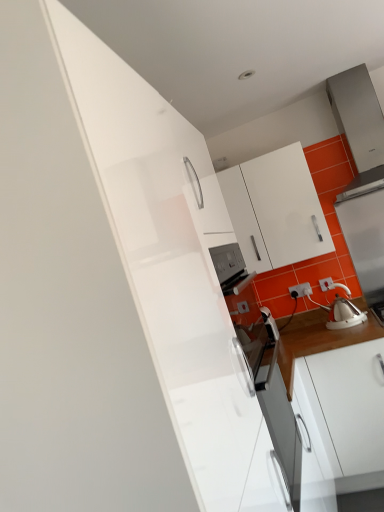
Measure the distance between white plastic electric outlet at lower right and camera.

white plastic electric outlet at lower right is 2.98 meters away from camera.

What do you see at coordinates (342, 310) in the screenshot?
I see `white glossy tea pot at right` at bounding box center [342, 310].

I want to click on white plastic electric outlet at lower right, so click(300, 290).

Consider the image. From a real-world perspective, is white plastic electric outlet at lower right physically located above or below white glossy tea pot at right?

From a real-world perspective, white plastic electric outlet at lower right is physically above white glossy tea pot at right.

Is white plastic electric outlet at lower right facing towards white glossy tea pot at right?

No, white plastic electric outlet at lower right is not oriented towards white glossy tea pot at right.

Is white plastic electric outlet at lower right bigger or smaller than white glossy tea pot at right?

Considering their sizes, white plastic electric outlet at lower right takes up less space than white glossy tea pot at right.

Between white plastic electric outlet at lower right and white glossy tea pot at right, which one has more height?

With more height is white glossy tea pot at right.

Is white plastic electric outlet at lower right to the left of white glossy cabinet at upper center from the viewer's perspective?

No.

Consider the image. How different are the orientations of white plastic electric outlet at lower right and white glossy cabinet at upper center in degrees?

white plastic electric outlet at lower right and white glossy cabinet at upper center are facing 0.00426 degrees away from each other.

Which of these two, white plastic electric outlet at lower right or white glossy cabinet at upper center, is smaller?

Smaller between the two is white plastic electric outlet at lower right.

In the scene shown: From the image's perspective, is white plastic electric outlet at lower right located beneath white glossy cabinet at upper center?

Yes, from the image's perspective, white plastic electric outlet at lower right is below white glossy cabinet at upper center.

From the image's perspective, which is above, white glossy cabinet at upper center or white plastic electric outlet at lower right?

From the image's view, white glossy cabinet at upper center is above.

Would you say white glossy cabinet at upper center is outside white plastic electric outlet at lower right?

Yes, white glossy cabinet at upper center is outside of white plastic electric outlet at lower right.

Which is less distant, (247, 222) or (305, 291)?

The point (247, 222) is closer.

Is white glossy cabinet at upper center thinner than white plastic electric outlet at lower right?

No, white glossy cabinet at upper center is not thinner than white plastic electric outlet at lower right.

Is white glossy tea pot at right completely or partially outside of white plastic electric outlet at lower right?

Yes, white glossy tea pot at right is located beyond the bounds of white plastic electric outlet at lower right.

Could you tell me if white glossy tea pot at right is facing white plastic electric outlet at lower right?

No, white glossy tea pot at right is not turned towards white plastic electric outlet at lower right.

Looking at this image, considering the relative sizes of white glossy tea pot at right and white plastic electric outlet at lower right in the image provided, is white glossy tea pot at right smaller than white plastic electric outlet at lower right?

No.

Is white glossy tea pot at right in contact with white plastic electric outlet at lower right?

No, white glossy tea pot at right is not in contact with white plastic electric outlet at lower right.

Looking at this image, considering the sizes of objects white glossy cabinet at upper center and white glossy kettle at right in the image provided, who is smaller, white glossy cabinet at upper center or white glossy kettle at right?

Smaller between the two is white glossy kettle at right.

Which of these two, white glossy cabinet at upper center or white glossy kettle at right, stands shorter?

Standing shorter between the two is white glossy cabinet at upper center.

Between point (243, 213) and point (362, 222), which one is positioned behind?

The point (362, 222) is farther from the camera.

Would you say white glossy cabinet at upper center is a long distance from white glossy kettle at right?

No, white glossy cabinet at upper center is not far away from white glossy kettle at right.

Which is farther, (376, 258) or (291, 149)?

The point (376, 258) is more distant.

How much distance is there between white glossy kettle at right and white glossy cabinet at upper center?

white glossy kettle at right and white glossy cabinet at upper center are 18.77 inches apart.

From the image's perspective, who appears lower, white glossy kettle at right or white glossy cabinet at upper center?

From the image's view, white glossy kettle at right is below.

Considering the relative sizes of white glossy kettle at right and white glossy cabinet at upper center in the image provided, is white glossy kettle at right thinner than white glossy cabinet at upper center?

Yes, white glossy kettle at right is thinner than white glossy cabinet at upper center.

From the image's perspective, between white glossy tea pot at right and white glossy cabinet at upper center, who is located below?

From the image's view, white glossy tea pot at right is below.

From a real-world perspective, is white glossy tea pot at right physically below white glossy cabinet at upper center?

Correct, in the physical world, white glossy tea pot at right is lower than white glossy cabinet at upper center.

Is white glossy tea pot at right far away from white glossy cabinet at upper center?

No, white glossy tea pot at right is not far away from white glossy cabinet at upper center.

Is white glossy tea pot at right to the left of white glossy cabinet at upper center from the viewer's perspective?

In fact, white glossy tea pot at right is to the right of white glossy cabinet at upper center.

At what (x,y) coordinates should I click in order to perform the action: click on electric outlet lying behind the white glossy tea pot at right. Please return your answer as a coordinate pair (x, y). The height and width of the screenshot is (512, 384). Looking at the image, I should click on pos(300,290).

Find the location of a particular element. electric outlet lying below the white glossy cabinet at upper center (from the image's perspective) is located at coordinates (300, 290).

Based on their spatial positions, is white glossy tea pot at right or white glossy cabinet at upper center further from white plastic electric outlet at lower right?

white glossy cabinet at upper center lies further to white plastic electric outlet at lower right than the other object.

Estimate the real-world distances between objects in this image. Which object is further from white plastic electric outlet at lower right, white glossy tea pot at right or white glossy kettle at right?

white glossy kettle at right lies further to white plastic electric outlet at lower right than the other object.

Looking at the image, which one is located closer to white plastic electric outlet at lower right, white glossy cabinet at upper center or white glossy kettle at right?

white glossy kettle at right is closer to white plastic electric outlet at lower right.

Estimate the real-world distances between objects in this image. Which object is closer to white plastic electric outlet at lower right, white glossy kettle at right or white glossy tea pot at right?

white glossy tea pot at right is closer to white plastic electric outlet at lower right.

Which object lies nearer to the anchor point white glossy tea pot at right, white glossy kettle at right or white plastic electric outlet at lower right?

Among the two, white plastic electric outlet at lower right is located nearer to white glossy tea pot at right.

When comparing their distances from white glossy cabinet at upper center, does white plastic electric outlet at lower right or white glossy kettle at right seem closer?

white glossy kettle at right is closer to white glossy cabinet at upper center.

Considering their positions, is white glossy cabinet at upper center positioned further to white glossy tea pot at right than white glossy kettle at right?

The object further to white glossy tea pot at right is white glossy cabinet at upper center.

Estimate the real-world distances between objects in this image. Which object is closer to white plastic electric outlet at lower right, white glossy kettle at right or white glossy cabinet at upper center?

Based on the image, white glossy kettle at right appears to be nearer to white plastic electric outlet at lower right.

You are a GUI agent. You are given a task and a screenshot of the screen. Output one action in this format:
    pyautogui.click(x=<x>, y=<y>)
    Task: Click on the electric outlet between white glossy cabinet at upper center and white glossy kettle at right
    The image size is (384, 512).
    Given the screenshot: What is the action you would take?
    pyautogui.click(x=300, y=290)

At what (x,y) coordinates should I click in order to perform the action: click on tea pot between white glossy cabinet at upper center and white glossy kettle at right in the horizontal direction. Please return your answer as a coordinate pair (x, y). The width and height of the screenshot is (384, 512). Looking at the image, I should click on (342, 310).

The height and width of the screenshot is (512, 384). Find the location of `tea pot situated between white plastic electric outlet at lower right and white glossy kettle at right from left to right`. tea pot situated between white plastic electric outlet at lower right and white glossy kettle at right from left to right is located at coordinates (342, 310).

Find the location of a particular element. This screenshot has width=384, height=512. electric outlet between white glossy cabinet at upper center and white glossy tea pot at right from top to bottom is located at coordinates (300, 290).